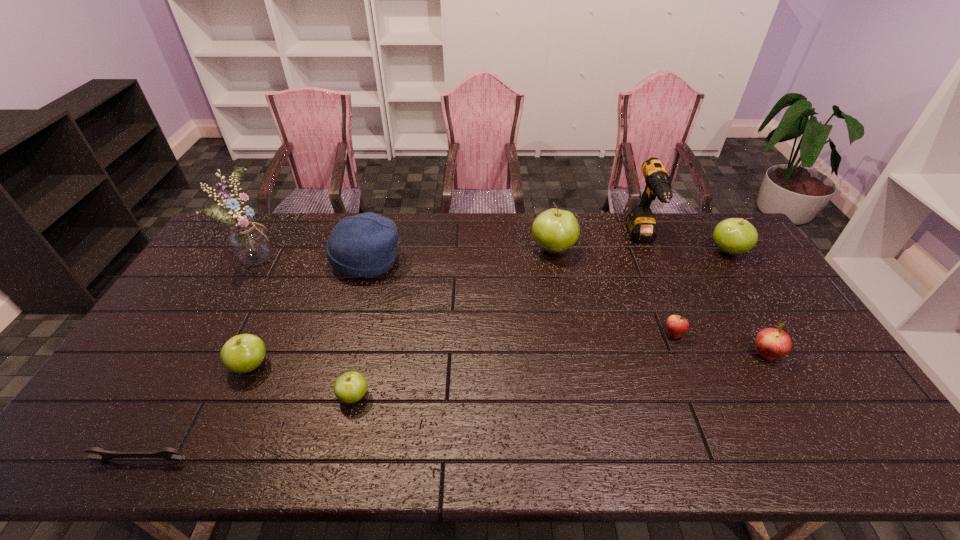
In the image, there is a desktop. Where is `blank space at the far right corner`? The height and width of the screenshot is (540, 960). blank space at the far right corner is located at coordinates (701, 233).

Where is `free spot between the third smallest green apple and the nearest object`? The width and height of the screenshot is (960, 540). free spot between the third smallest green apple and the nearest object is located at coordinates (434, 355).

Locate an element on the screen. The width and height of the screenshot is (960, 540). empty space between the black drill and the farther red apple is located at coordinates (658, 286).

Where is `free space between the skullcap and the green bouquet`? The height and width of the screenshot is (540, 960). free space between the skullcap and the green bouquet is located at coordinates (314, 259).

In order to click on empty space between the tallest apple and the nearer red apple in this screenshot , I will do `click(660, 302)`.

I want to click on blank region between the nearest object and the third biggest green apple, so click(x=195, y=413).

Find the location of a particular element. empty location between the wrench and the black drill is located at coordinates (391, 349).

At what (x,y) coordinates should I click in order to perform the action: click on free space that is in between the second tallest object and the second biggest green apple. Please return your answer as a coordinate pair (x, y). Looking at the image, I should click on (684, 245).

Locate an element on the screen. This screenshot has width=960, height=540. empty space between the biggest green apple and the leftmost green apple is located at coordinates (401, 307).

The image size is (960, 540). Find the location of `free area in between the second biggest green apple and the third green apple from right to left`. free area in between the second biggest green apple and the third green apple from right to left is located at coordinates (540, 324).